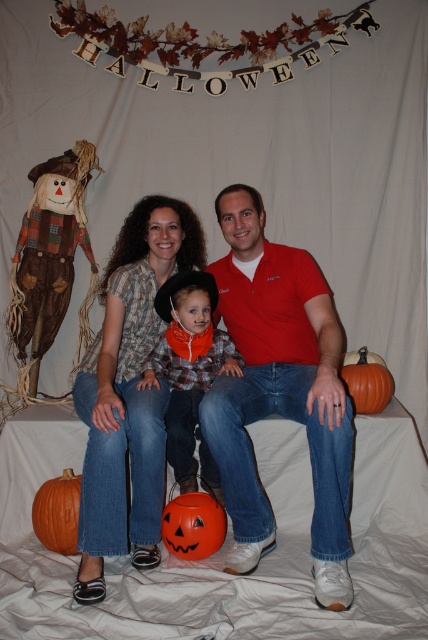
Question: Which point appears farthest from the camera in this image?

Choices:
 (A) (360, 404)
 (B) (327, 381)
 (C) (166, 538)

Answer: (A)

Question: Which of the following is the closest to the observer?

Choices:
 (A) orange matte pumpkin at center
 (B) matte plaid shirt at center

Answer: (B)

Question: Does red cotton shirt at center appear over orange matte pumpkin at center?

Choices:
 (A) no
 (B) yes

Answer: (B)

Question: Among these points, which one is farthest from the camera?

Choices:
 (A) (247, 541)
 (B) (187, 371)
 (C) (374, 404)

Answer: (C)

Question: Is matte plaid shirt at center to the right of orange matte pumpkin at lower left from the viewer's perspective?

Choices:
 (A) yes
 (B) no

Answer: (A)

Question: Can you confirm if red cotton shirt at center is positioned to the right of plaid fabric shirt at center?

Choices:
 (A) yes
 (B) no

Answer: (A)